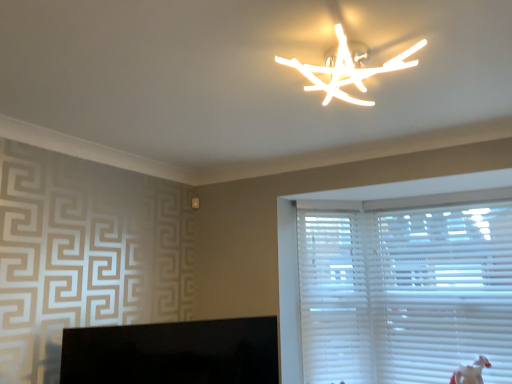
Question: From the image's perspective, does white matte branch-like fixture at upper center appear higher than white plastic blinds at right?

Choices:
 (A) yes
 (B) no

Answer: (A)

Question: From a real-world perspective, is white matte branch-like fixture at upper center over white plastic blinds at right?

Choices:
 (A) yes
 (B) no

Answer: (A)

Question: Does white matte branch-like fixture at upper center have a lesser height compared to white plastic blinds at right?

Choices:
 (A) no
 (B) yes

Answer: (B)

Question: From the image's perspective, is white matte branch-like fixture at upper center below white plastic blinds at right?

Choices:
 (A) no
 (B) yes

Answer: (A)

Question: Is white matte branch-like fixture at upper center positioned in front of white plastic blinds at right?

Choices:
 (A) yes
 (B) no

Answer: (A)

Question: Considering the relative positions of white matte branch-like fixture at upper center and white plastic blinds at right in the image provided, is white matte branch-like fixture at upper center to the right of white plastic blinds at right from the viewer's perspective?

Choices:
 (A) no
 (B) yes

Answer: (A)

Question: Considering the relative sizes of white matte branch-like fixture at upper center and white plastic blinds at right in the image provided, is white matte branch-like fixture at upper center shorter than white plastic blinds at right?

Choices:
 (A) yes
 (B) no

Answer: (A)

Question: Is white matte branch-like fixture at upper center wider than white plastic blinds at right?

Choices:
 (A) yes
 (B) no

Answer: (A)

Question: Is white matte branch-like fixture at upper center with white plastic blinds at right?

Choices:
 (A) yes
 (B) no

Answer: (B)

Question: Is white matte branch-like fixture at upper center positioned behind white plastic blinds at right?

Choices:
 (A) yes
 (B) no

Answer: (B)

Question: Would you say white matte branch-like fixture at upper center is outside white plastic blinds at right?

Choices:
 (A) yes
 (B) no

Answer: (A)

Question: From a real-world perspective, is white matte branch-like fixture at upper center physically below white plastic blinds at right?

Choices:
 (A) yes
 (B) no

Answer: (B)

Question: From the image's perspective, is black glossy monitor at lower left located beneath white plastic blinds at right?

Choices:
 (A) yes
 (B) no

Answer: (A)